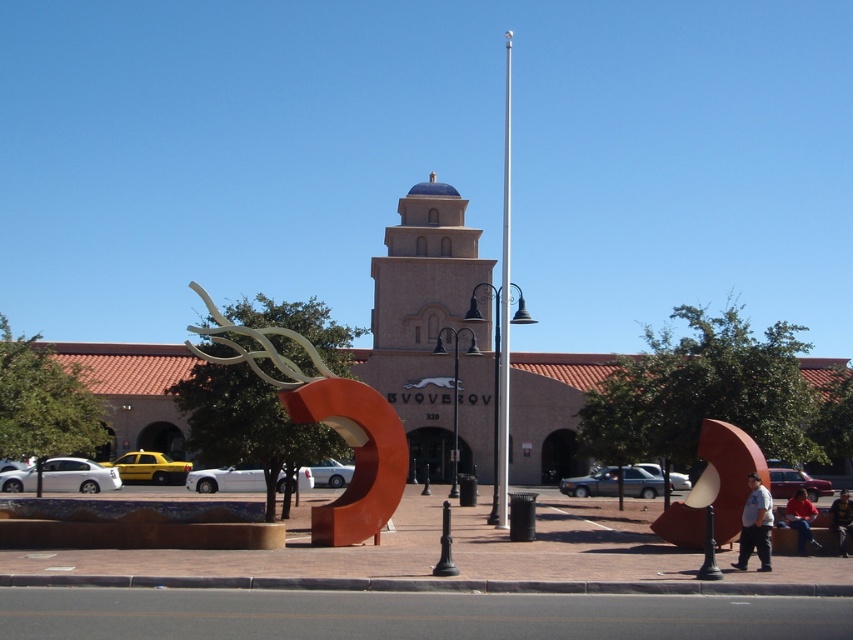
You are a maintenance worker needing to reach both the rustic metal sculpture at center and the silver metallic flag pole at center. If your ladder can extend up to 25 meters, which object can you reach without moving the ladder?

The distance between the rustic metal sculpture at center and the silver metallic flag pole at center is 26.46 meters. Since your ladder can only extend up to 25 meters, you cannot reach either object without moving the ladder.

You are a tour guide leading a group to the entrance of the building. You see the rustic metal sculpture at center and the denim jacket at lower right. The entrance is located near the building. Which object is closer to the entrance?

The rustic metal sculpture at center is closer to the entrance than the denim jacket at lower right because it is positioned between them at 10.09 meters away from the denim jacket.

From the picture: You are standing in the plaza and want to take a photo of the beige stucco bell tower at center and the denim jacket at lower right. Which object will appear larger in your photo?

The beige stucco bell tower at center will appear larger in the photo because it is closer to the viewer than the denim jacket at lower right.